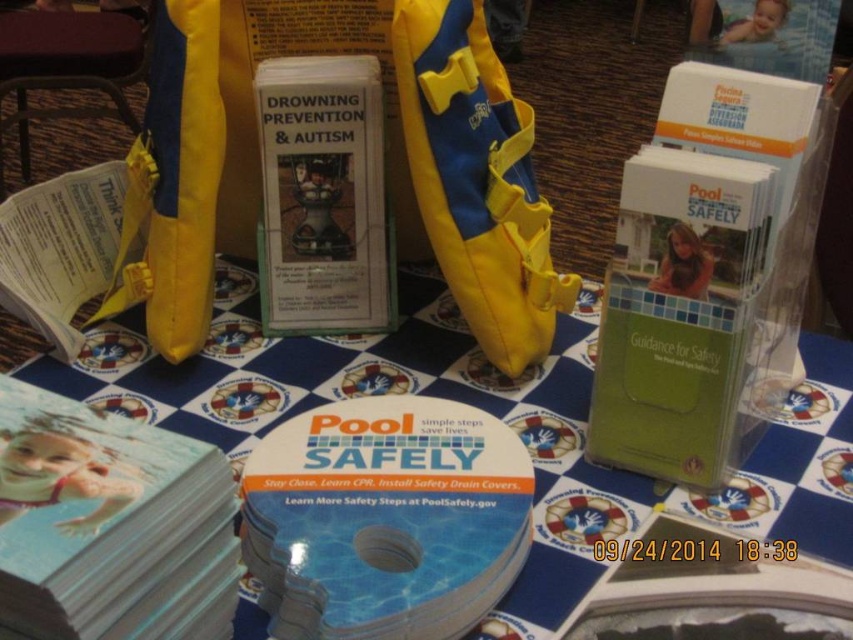
You are a parent preparing for a family pool day. You have a 36 inch long pool noodle that you want to place between the yellow fabric life vest at center and the yellow paper at left. Will the noodle fit between them?

The yellow fabric life vest at center and yellow paper at left are 10.24 inches apart from each other. Since the pool noodle is 36 inches long, it is longer than the distance between them. Therefore, the noodle will not fit between them as it is too long.

You are organizing a pool safety workshop and need to hand out materials. You have a blue printed paper at center and a white paper book at center on the table. Which material should you pick up first if you want to start with the one that is higher?

The blue printed paper at center is located above the white paper book at center, so you should pick up the blue printed paper at center first.

You are standing 12 inches away from the table. Can you reach the point at coordinates point [252,636] on the table without moving closer?

The distance of point [252,636] from viewer is 12.68 inches. Since you are only 12 inches away from the table, you are 0.68 inches too far to reach the point without moving closer.